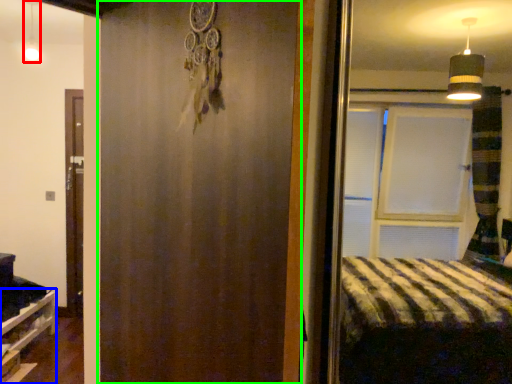
Question: Which object is positioned farthest from light fixture (highlighted by a red box)? Select from shelf (highlighted by a blue box) and barn door (highlighted by a green box).

Choices:
 (A) shelf
 (B) barn door

Answer: (B)